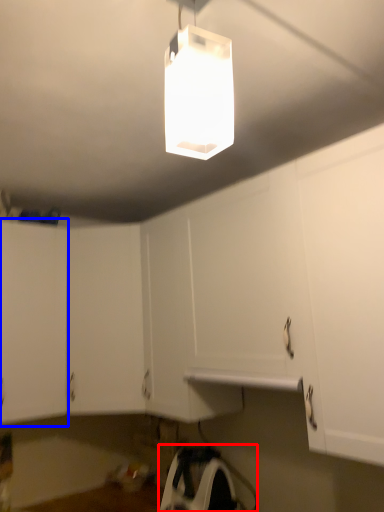
Question: Which object is closer to the camera taking this photo, appliance (highlighted by a red box) or cabinetry (highlighted by a blue box)?

Choices:
 (A) appliance
 (B) cabinetry

Answer: (A)